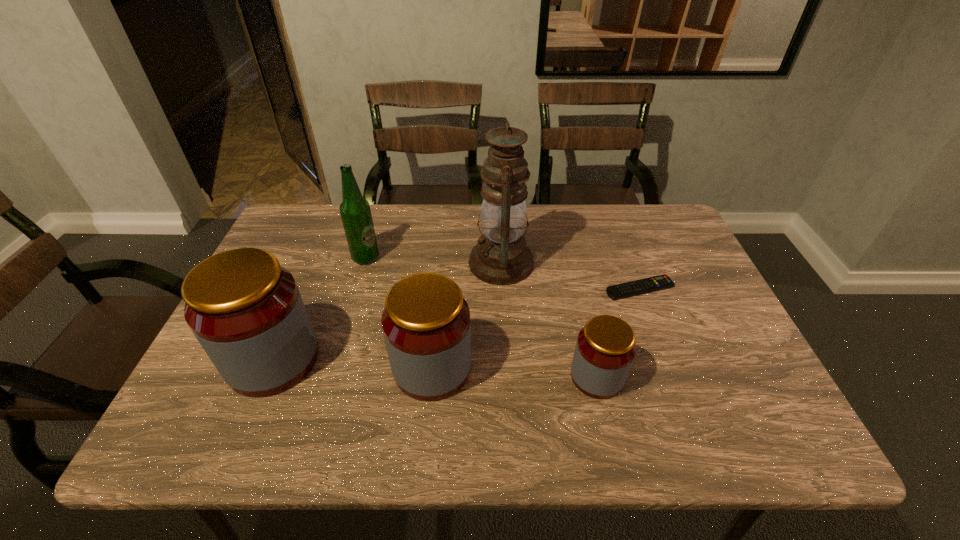
I want to click on vacant space at the far edge of the desktop, so click(x=396, y=221).

Locate an element on the screen. This screenshot has width=960, height=540. vacant position at the near edge of the desktop is located at coordinates (575, 387).

Locate an element on the screen. The height and width of the screenshot is (540, 960). vacant space at the right edge of the desktop is located at coordinates (691, 286).

This screenshot has width=960, height=540. What are the coordinates of `vacant space at the far left corner` in the screenshot? It's located at (332, 214).

The image size is (960, 540). What are the coordinates of `vacant space at the near left corner of the desktop` in the screenshot? It's located at coord(188,402).

Find the location of a particular element. The width and height of the screenshot is (960, 540). vacant area at the far right corner is located at coordinates (655, 251).

Where is `vacant space in between the beer bottle and the leftmost object`? The image size is (960, 540). vacant space in between the beer bottle and the leftmost object is located at coordinates (320, 308).

Identify the location of free space between the leftmost jar and the beer bottle. The image size is (960, 540). (320, 308).

Locate an element on the screen. This screenshot has height=540, width=960. free point between the rightmost object and the tallest object is located at coordinates (570, 275).

This screenshot has height=540, width=960. Find the location of `free area in between the remote control and the second jar from right to left`. free area in between the remote control and the second jar from right to left is located at coordinates (536, 328).